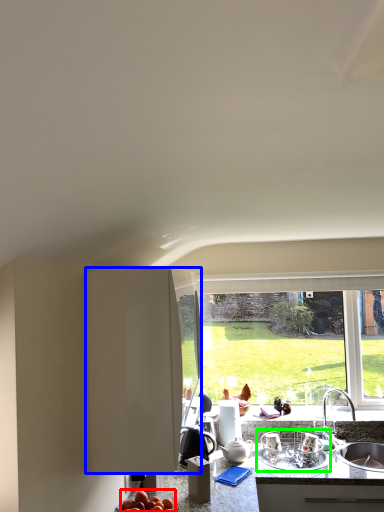
Question: Based on their relative distances, which object is farther from apple (highlighted by a red box)? Choose from cabinetry (highlighted by a blue box) and appliance (highlighted by a green box).

Choices:
 (A) cabinetry
 (B) appliance

Answer: (B)